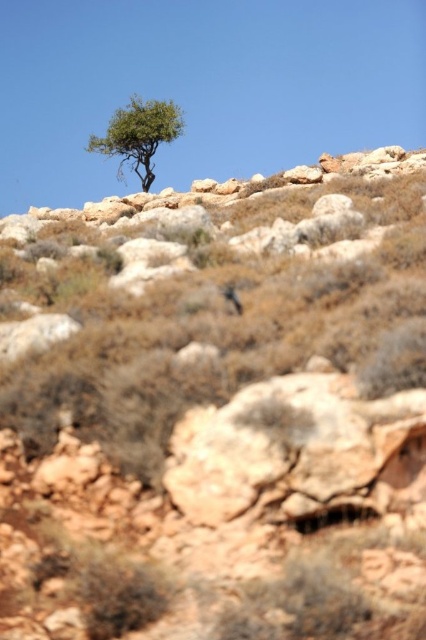
Does rusty rock at center appear on the left side of green leafy tree at upper center?

No, rusty rock at center is not to the left of green leafy tree at upper center.

Does point (230, 518) lie behind point (170, 131)?

No, it is not.

Is point (212, 456) positioned before point (109, 140)?

Yes, point (212, 456) is closer to viewer.

This screenshot has width=426, height=640. What are the coordinates of `rusty rock at center` in the screenshot? It's located at (299, 451).